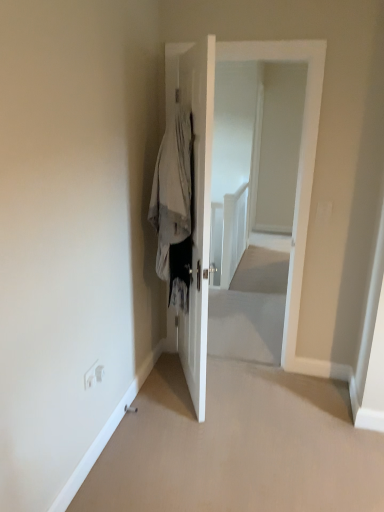
Question: Considering the relative sizes of white glossy door at center, positioned as the 2th door in right-to-left order, and light gray fabric coat at center in the image provided, is white glossy door at center, positioned as the 2th door in right-to-left order, thinner than light gray fabric coat at center?

Choices:
 (A) no
 (B) yes

Answer: (B)

Question: Is white glossy door at center, positioned as the 2th door in right-to-left order, positioned behind light gray fabric coat at center?

Choices:
 (A) no
 (B) yes

Answer: (A)

Question: From the image's perspective, is white glossy door at center, positioned as the 2th door in right-to-left order, below light gray fabric coat at center?

Choices:
 (A) no
 (B) yes

Answer: (B)

Question: Considering the relative sizes of white glossy door at center, placed as the 1th door when sorted from left to right, and light gray fabric coat at center in the image provided, is white glossy door at center, placed as the 1th door when sorted from left to right, smaller than light gray fabric coat at center?

Choices:
 (A) yes
 (B) no

Answer: (B)

Question: Is white glossy door at center, placed as the 1th door when sorted from left to right, to the left of light gray fabric coat at center from the viewer's perspective?

Choices:
 (A) no
 (B) yes

Answer: (A)

Question: Can you confirm if white glossy door at center, placed as the 1th door when sorted from left to right, is taller than light gray fabric coat at center?

Choices:
 (A) yes
 (B) no

Answer: (A)

Question: Is light gray fabric coat at center looking in the opposite direction of white glossy door at center, which is the first door in right-to-left order?

Choices:
 (A) yes
 (B) no

Answer: (B)

Question: Can you confirm if light gray fabric coat at center is shorter than white glossy door at center, marked as the second door in a left-to-right arrangement?

Choices:
 (A) no
 (B) yes

Answer: (B)

Question: From a real-world perspective, does light gray fabric coat at center sit lower than white glossy door at center, which is the first door in right-to-left order?

Choices:
 (A) yes
 (B) no

Answer: (B)

Question: Can we say light gray fabric coat at center lies outside white glossy door at center, marked as the second door in a left-to-right arrangement?

Choices:
 (A) yes
 (B) no

Answer: (A)

Question: Does light gray fabric coat at center have a smaller size compared to white glossy door at center, marked as the second door in a left-to-right arrangement?

Choices:
 (A) yes
 (B) no

Answer: (A)

Question: Is white glossy door at center, which is the first door in right-to-left order, inside light gray fabric coat at center?

Choices:
 (A) no
 (B) yes

Answer: (A)

Question: Can you confirm if white glossy door at center, positioned as the 2th door in right-to-left order, is wider than white glossy door at center, which is the first door in right-to-left order?

Choices:
 (A) no
 (B) yes

Answer: (A)